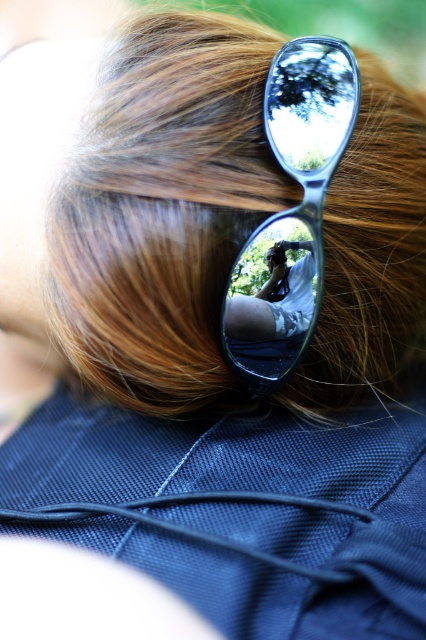
Question: Considering the relative positions of brown shiny hair at upper center and metallic reflective sunglasses at center in the image provided, where is brown shiny hair at upper center located with respect to metallic reflective sunglasses at center?

Choices:
 (A) above
 (B) below

Answer: (A)

Question: Is brown shiny hair at upper center wider than metallic reflective sunglasses at center?

Choices:
 (A) no
 (B) yes

Answer: (B)

Question: Is brown shiny hair at upper center to the right of metallic reflective sunglasses at center from the viewer's perspective?

Choices:
 (A) yes
 (B) no

Answer: (B)

Question: Among these points, which one is farthest from the camera?

Choices:
 (A) (267, 332)
 (B) (420, 282)

Answer: (B)